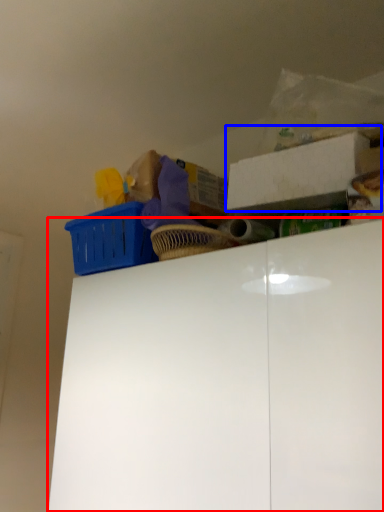
Question: Among these objects, which one is farthest to the camera, cabinetry (highlighted by a red box) or storage box (highlighted by a blue box)?

Choices:
 (A) cabinetry
 (B) storage box

Answer: (B)